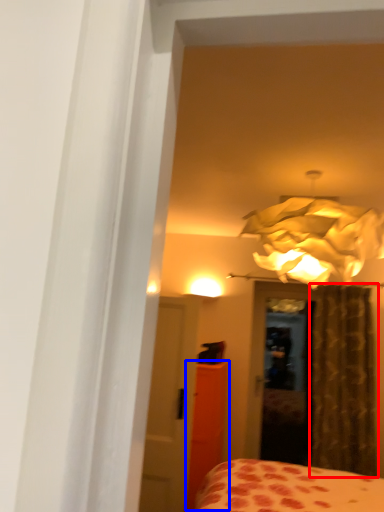
Question: Which of the following is the farthest to the observer, curtain (highlighted by a red box) or armoire (highlighted by a blue box)?

Choices:
 (A) curtain
 (B) armoire

Answer: (A)